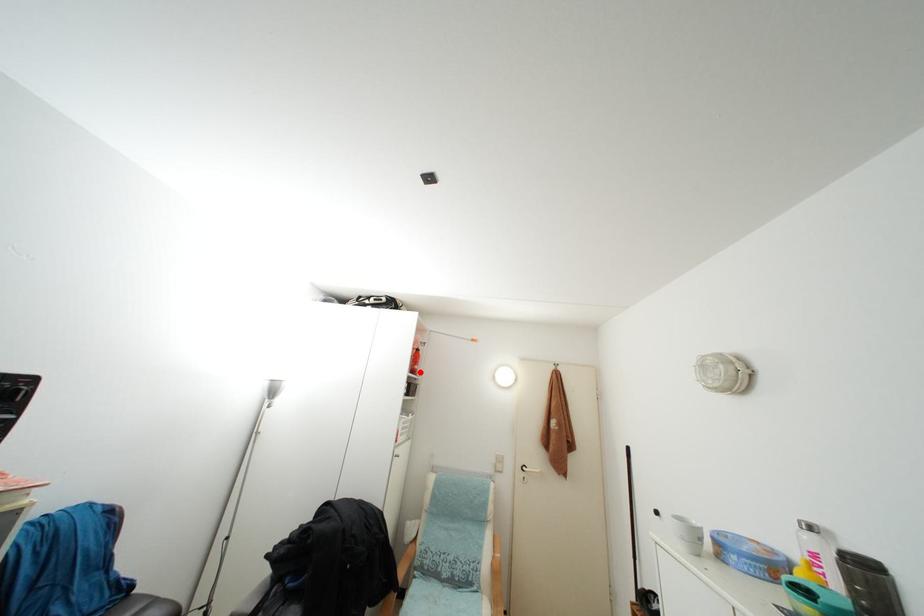
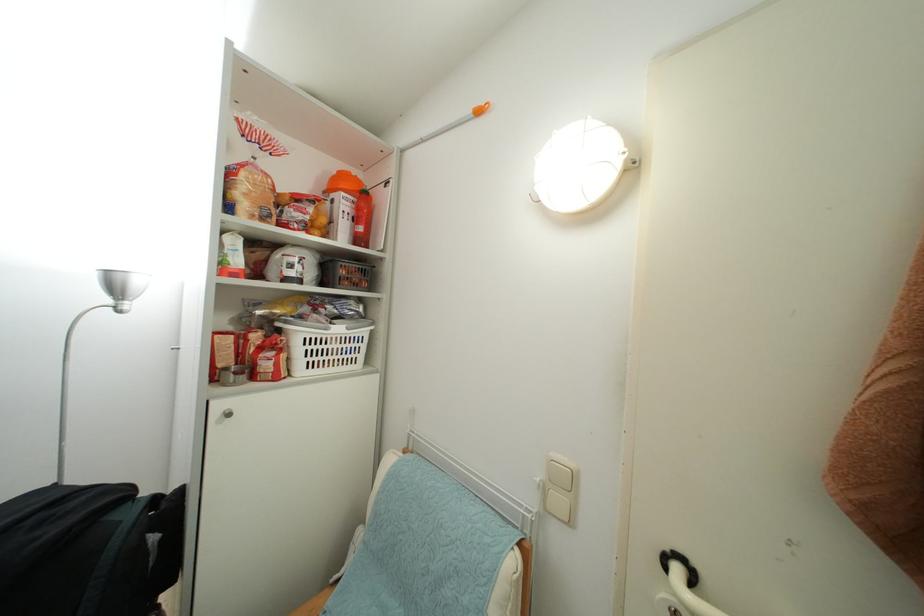
The point at the highlighted location is marked in the first image. Where is the corresponding point in the second image?

(365, 235)